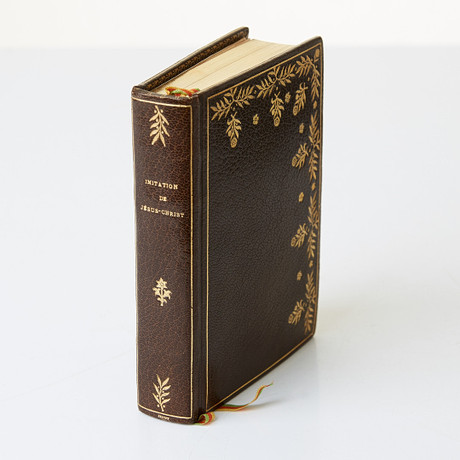
Identify the location of fold between the book spine and front cover. Image resolution: width=460 pixels, height=460 pixels. (199, 253).